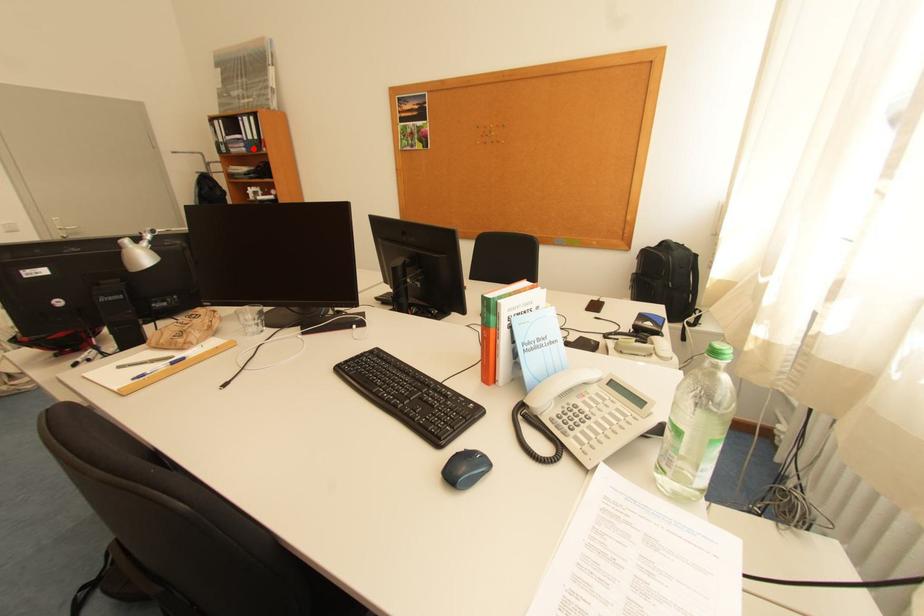
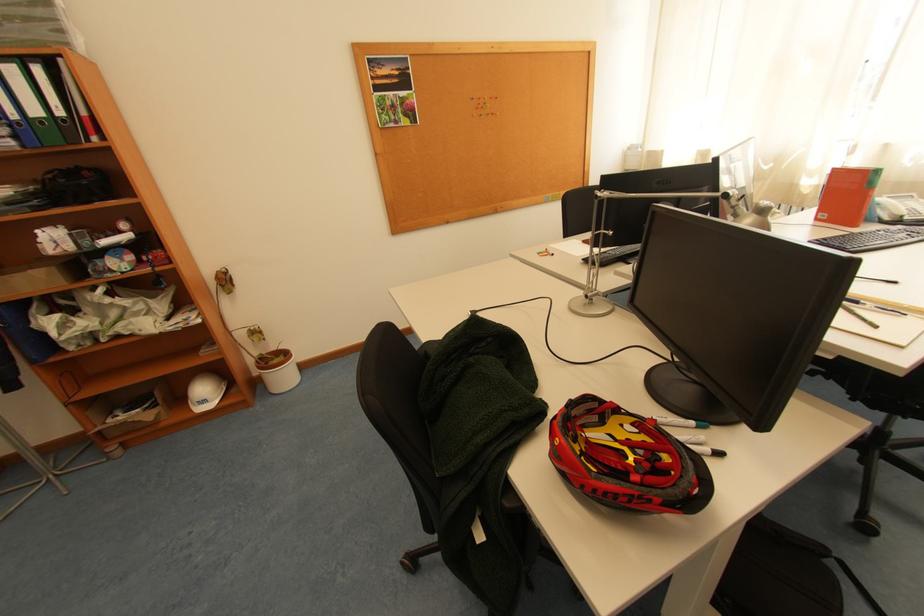
Question: A red point is marked in image1. In image2, is the corresponding 3D point closer to the camera or farther? Reply with the corresponding letter.

Choices:
 (A) The corresponding 3D point is closer.
 (B) The corresponding 3D point is farther.

Answer: (B)